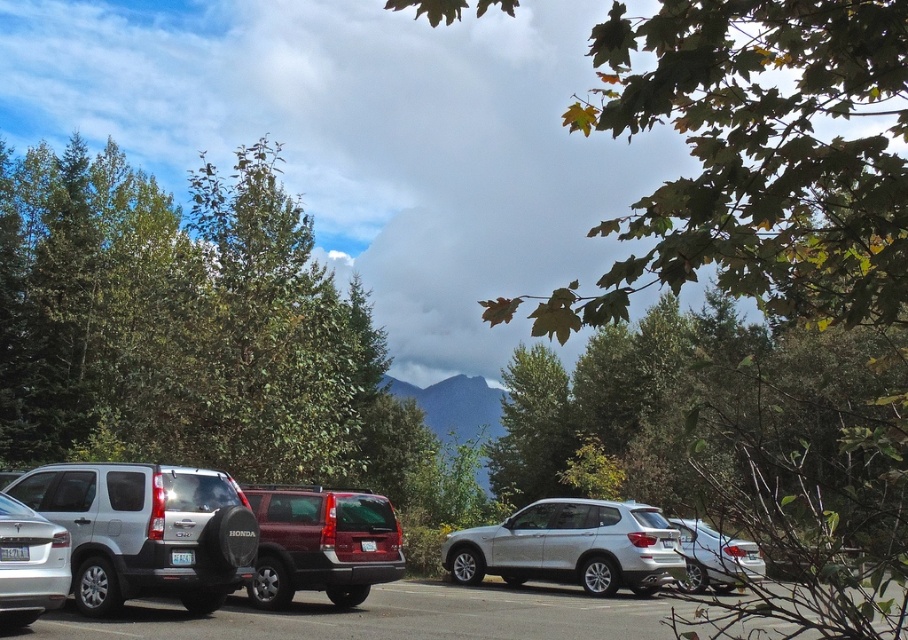
Does matte silver minivan at center-left appear under satin silver car at center?

Actually, matte silver minivan at center-left is above satin silver car at center.

Based on the photo, is matte silver minivan at center-left positioned behind satin silver car at center?

Yes, it is.

Is point (65, 522) positioned after point (390, 637)?

Yes, point (65, 522) is farther from viewer.

The height and width of the screenshot is (640, 908). What are the coordinates of `matte silver minivan at center-left` in the screenshot? It's located at (146, 531).

Between matte silver minivan at center-left and silver metallic suv at center, which one appears on the right side from the viewer's perspective?

Positioned to the right is silver metallic suv at center.

Who is more forward, [166,595] or [568,561]?

Positioned in front is point [166,595].

Image resolution: width=908 pixels, height=640 pixels. In order to click on matte silver minivan at center-left in this screenshot , I will do `click(146, 531)`.

The image size is (908, 640). Find the location of `matte silver minivan at center-left`. matte silver minivan at center-left is located at coordinates tap(146, 531).

Between matte silver minivan at center-left and silver metallic sedan at lower left, which one has less height?

silver metallic sedan at lower left is shorter.

Does matte silver minivan at center-left have a lesser width compared to silver metallic sedan at lower left?

In fact, matte silver minivan at center-left might be wider than silver metallic sedan at lower left.

Locate an element on the screen. Image resolution: width=908 pixels, height=640 pixels. matte silver minivan at center-left is located at coordinates (146, 531).

Locate an element on the screen. This screenshot has height=640, width=908. matte silver minivan at center-left is located at coordinates (146, 531).